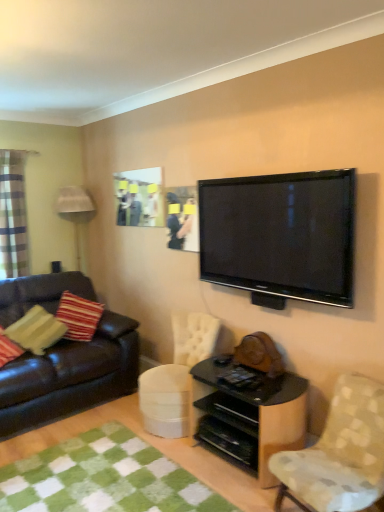
You are a GUI agent. You are given a task and a screenshot of the screen. Output one action in this format:
    pyautogui.click(x=<x>, y=<y>)
    Task: Click on the vacant space situated above black glossy shelf at lower center (from a real-world perspective)
    The width and height of the screenshot is (384, 512).
    Given the screenshot: What is the action you would take?
    pyautogui.click(x=244, y=378)